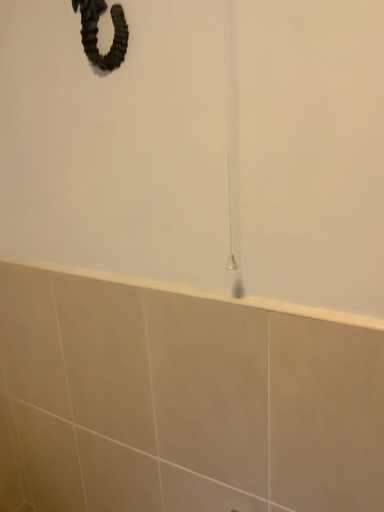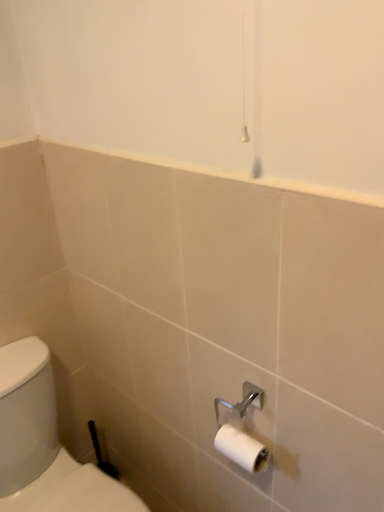
Question: Which way did the camera rotate in the video?

Choices:
 (A) rotated left
 (B) rotated right

Answer: (A)